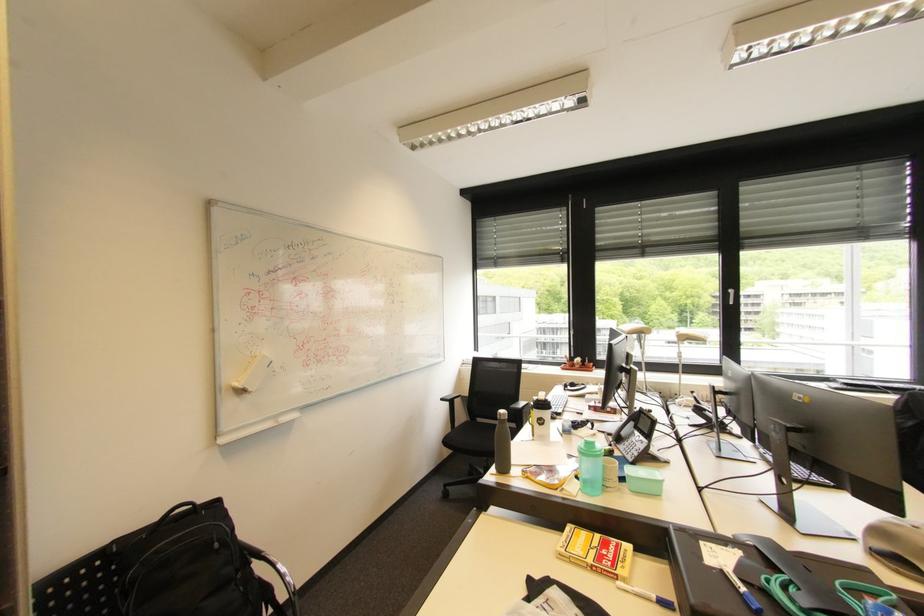
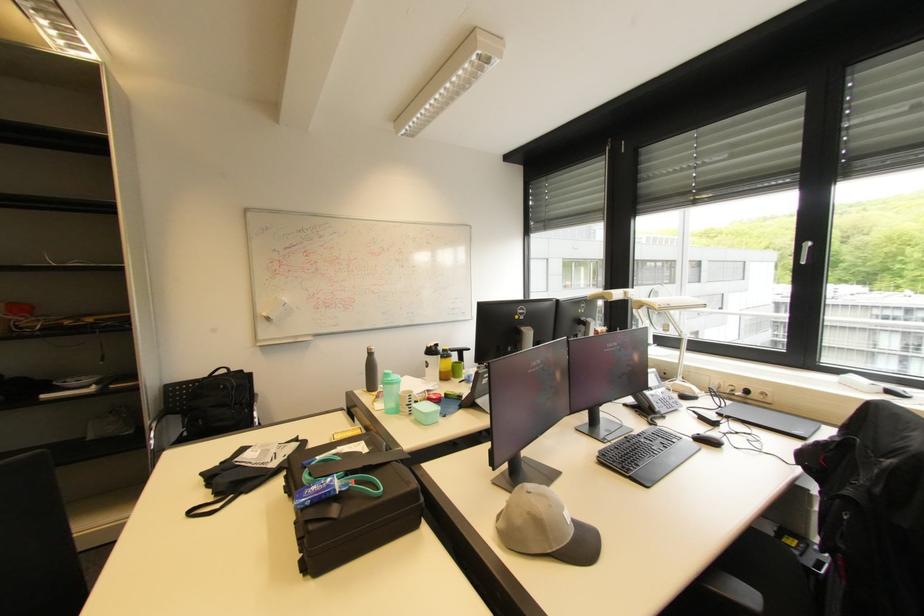
Locate, in the second image, the point that corresponds to pixel 601 448 in the first image.

(394, 379)